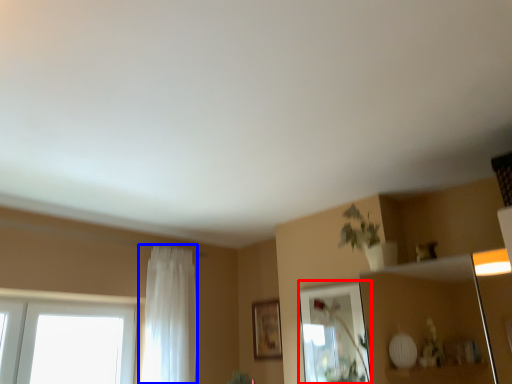
Question: Which object is closer to the camera taking this photo, mirror (highlighted by a red box) or curtain (highlighted by a blue box)?

Choices:
 (A) mirror
 (B) curtain

Answer: (A)